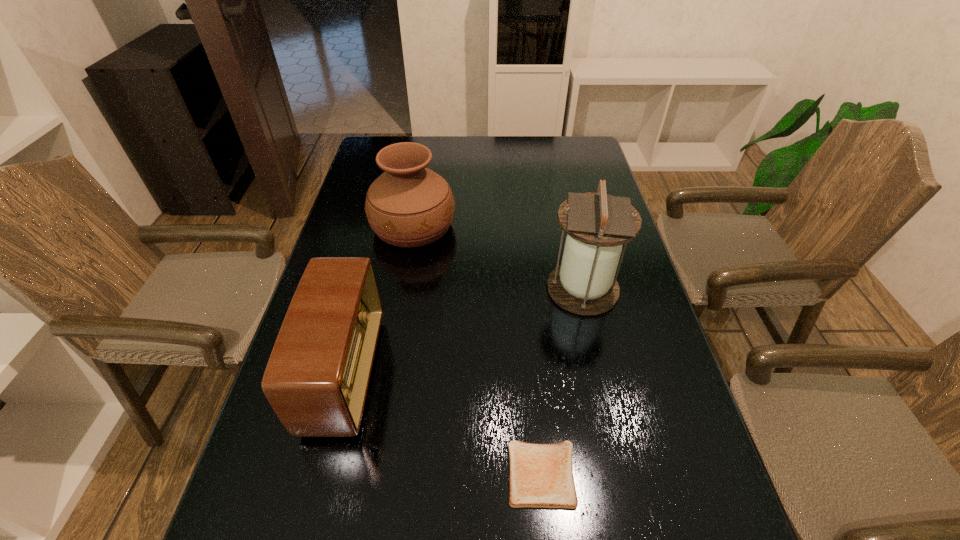
Identify the location of free spot between the toast and the radio receiver. (444, 424).

You are a GUI agent. You are given a task and a screenshot of the screen. Output one action in this format:
    pyautogui.click(x=<x>, y=<y>)
    Task: Click on the vacant space that is in between the third nearest object and the urn
    The image size is (960, 540).
    Given the screenshot: What is the action you would take?
    pyautogui.click(x=498, y=258)

At what (x,y) coordinates should I click in order to perform the action: click on free spot between the toast and the urn. Please return your answer as a coordinate pair (x, y). This screenshot has width=960, height=540. Looking at the image, I should click on (478, 350).

Locate an element on the screen. blank region between the third nearest object and the radio receiver is located at coordinates (464, 331).

Identify which object is located as the third nearest to the radio receiver. Please provide its 2D coordinates. Your answer should be formatted as a tuple, i.e. [(x, y)], where the tuple contains the x and y coordinates of a point satisfying the conditions above.

[(597, 224)]

Identify the location of object identified as the third closest to the toast. (409, 205).

Locate an element on the screen. vacant space that satisfies the following two spatial constraints: 1. on the front-facing side of the radio receiver; 2. on the back side of the shortest object is located at coordinates (321, 474).

Where is `vacant space that satisfies the following two spatial constraints: 1. on the front-facing side of the radio receiver; 2. on the left side of the toast`? Image resolution: width=960 pixels, height=540 pixels. vacant space that satisfies the following two spatial constraints: 1. on the front-facing side of the radio receiver; 2. on the left side of the toast is located at coordinates (321, 474).